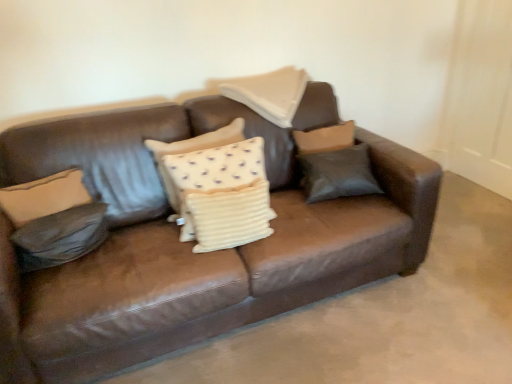
Question: Is matte brown pillow at center, which ranks as the 1th pillow in right-to-left order, with leather pillow at left, which ranks as the 5th pillow in right-to-left order?

Choices:
 (A) yes
 (B) no

Answer: (B)

Question: Is matte brown pillow at center, which ranks as the 1th pillow in right-to-left order, positioned beyond the bounds of leather pillow at left, which is counted as the first pillow, starting from the left?

Choices:
 (A) no
 (B) yes

Answer: (B)

Question: Considering the relative positions of matte brown pillow at center, the fifth pillow from the left, and leather pillow at left, which is counted as the first pillow, starting from the left, in the image provided, is matte brown pillow at center, the fifth pillow from the left, to the right of leather pillow at left, which is counted as the first pillow, starting from the left, from the viewer's perspective?

Choices:
 (A) no
 (B) yes

Answer: (B)

Question: From a real-world perspective, is matte brown pillow at center, the fifth pillow from the left, below leather pillow at left, which ranks as the 5th pillow in right-to-left order?

Choices:
 (A) no
 (B) yes

Answer: (A)

Question: Does matte brown pillow at center, the fifth pillow from the left, turn towards leather pillow at left, which ranks as the 5th pillow in right-to-left order?

Choices:
 (A) yes
 (B) no

Answer: (B)

Question: Does matte brown pillow at center, which ranks as the 1th pillow in right-to-left order, have a greater height compared to leather pillow at left, which ranks as the 5th pillow in right-to-left order?

Choices:
 (A) no
 (B) yes

Answer: (B)

Question: Is leather pillow at left, which ranks as the 5th pillow in right-to-left order, looking in the opposite direction of white textured pillow at center, acting as the third pillow starting from the right?

Choices:
 (A) yes
 (B) no

Answer: (B)

Question: Is leather pillow at left, which is counted as the first pillow, starting from the left, positioned beyond the bounds of white textured pillow at center, acting as the third pillow starting from the right?

Choices:
 (A) yes
 (B) no

Answer: (A)

Question: Can you confirm if leather pillow at left, which ranks as the 5th pillow in right-to-left order, is positioned to the right of white textured pillow at center, acting as the third pillow starting from the right?

Choices:
 (A) yes
 (B) no

Answer: (B)

Question: Could you tell me if leather pillow at left, which ranks as the 5th pillow in right-to-left order, is facing white textured pillow at center, acting as the third pillow starting from the right?

Choices:
 (A) yes
 (B) no

Answer: (B)

Question: Is leather pillow at left, which is counted as the first pillow, starting from the left, taller than white textured pillow at center, acting as the third pillow starting from the right?

Choices:
 (A) yes
 (B) no

Answer: (B)

Question: Considering the relative positions of leather pillow at left, which is counted as the first pillow, starting from the left, and white textured pillow at center, the 3th pillow when ordered from left to right, in the image provided, is leather pillow at left, which is counted as the first pillow, starting from the left, behind white textured pillow at center, the 3th pillow when ordered from left to right,?

Choices:
 (A) no
 (B) yes

Answer: (A)

Question: Is white textured pillow at center, positioned as the 2th pillow in left-to-right order, turned away from brown leather couch at center?

Choices:
 (A) yes
 (B) no

Answer: (B)